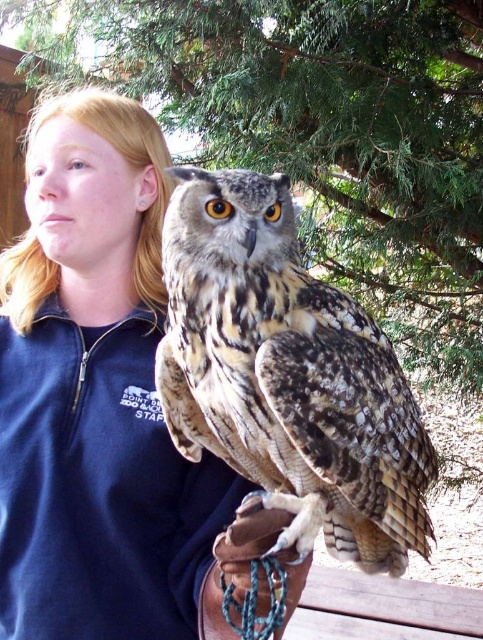
You are a photographer trying to capture a clear photo of the owl. The blue fleece jacket at upper left and the green leafy tree at upper center are blocking your view. Which object should you move closer to the camera to make the owl more visible?

The blue fleece jacket at upper left is thinner than the green leafy tree at upper center, so moving the blue fleece jacket at upper left closer to the camera would block less of the view compared to moving the green leafy tree at upper center.

You are a zookeeper holding an owl on your brown leather glove at lower center. You need to place the owl on a branch of the green leafy tree at upper center. Can you reach the branch if you can stretch your arm 1.5 meters?

The distance between the green leafy tree at upper center and brown leather glove at lower center is 1.86 meters. Since your arm can only stretch 1.5 meters, you cannot reach the branch.